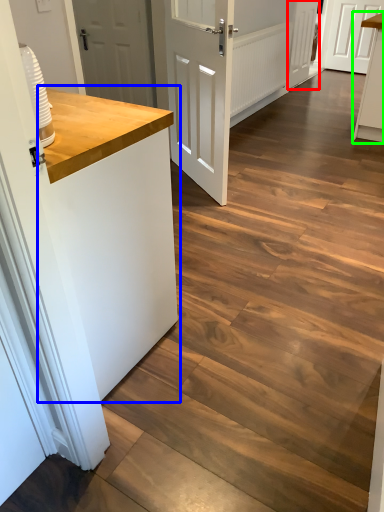
Question: Estimate the real-world distances between objects in this image. Which object is closer to door (highlighted by a red box), counter top (highlighted by a blue box) or cabinetry (highlighted by a green box)?

Choices:
 (A) counter top
 (B) cabinetry

Answer: (B)